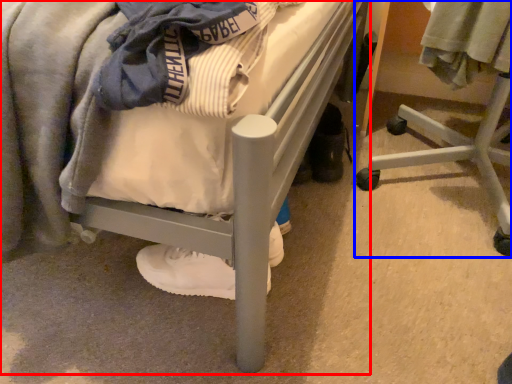
Question: Among these objects, which one is farthest to the camera, bed (highlighted by a red box) or furniture (highlighted by a blue box)?

Choices:
 (A) bed
 (B) furniture

Answer: (B)